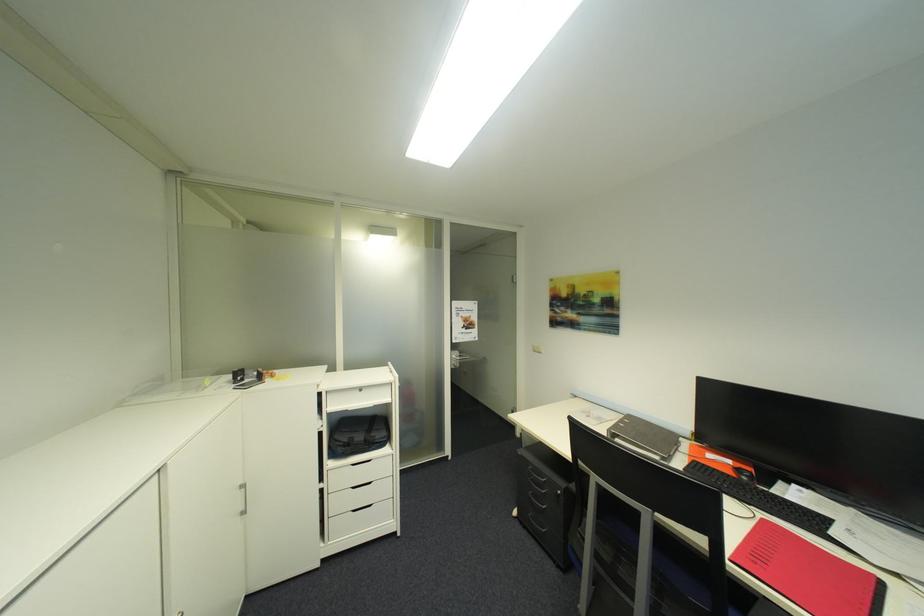
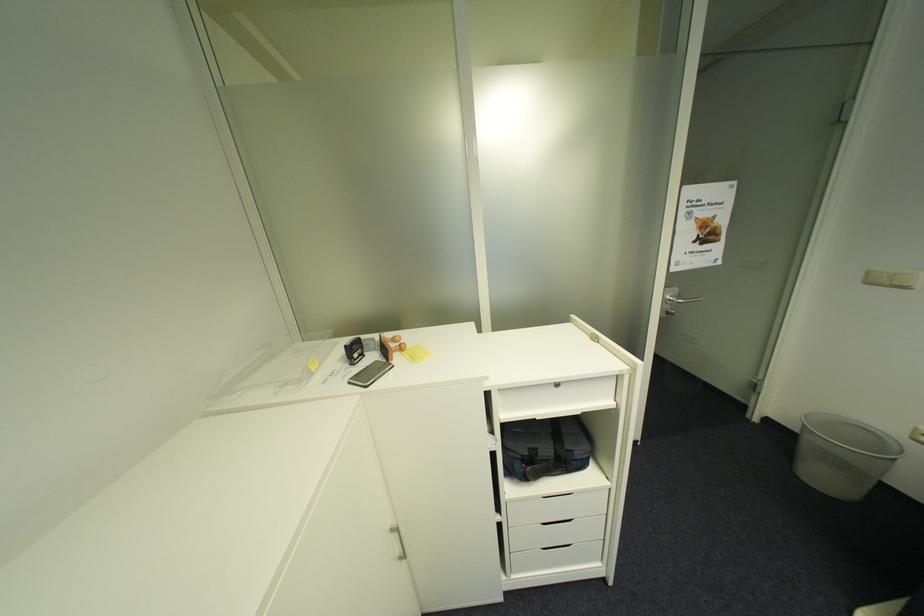
In the second image, find the point that corresponds to (x=463, y=359) in the first image.

(676, 301)